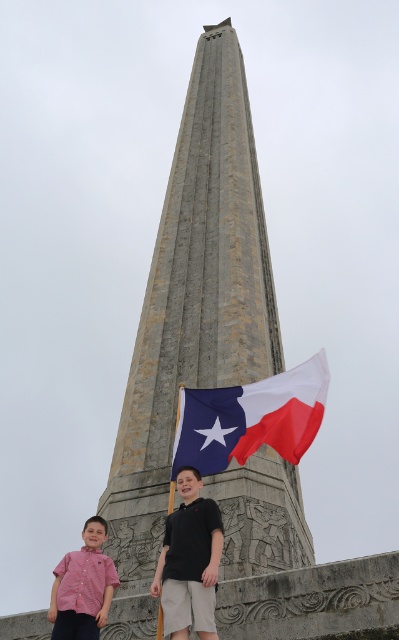
Does pink cotton shirt at lower left lie behind red checkered shirt at lower left?

No, it is in front of red checkered shirt at lower left.

Can you confirm if pink cotton shirt at lower left is bigger than red checkered shirt at lower left?

Incorrect, pink cotton shirt at lower left is not larger than red checkered shirt at lower left.

Based on the photo, who is more forward, (187, 624) or (86, 612)?

Point (187, 624)

In order to click on pink cotton shirt at lower left in this screenshot , I will do `click(189, 560)`.

How far apart are black cotton shirt at center and red checkered shirt at lower left?

6.00 meters

Is point (215, 557) positioned before point (88, 600)?

Yes, it is.

Which is in front, point (203, 624) or point (79, 614)?

Positioned in front is point (203, 624).

In order to click on black cotton shirt at center in this screenshot , I will do `click(191, 547)`.

Measure the distance between gray stone tower at center and blue fabric texas flag at center.

gray stone tower at center is 34.82 meters from blue fabric texas flag at center.

Is point (195, 328) closer to camera compared to point (290, 392)?

No.

I want to click on gray stone tower at center, so click(191, 312).